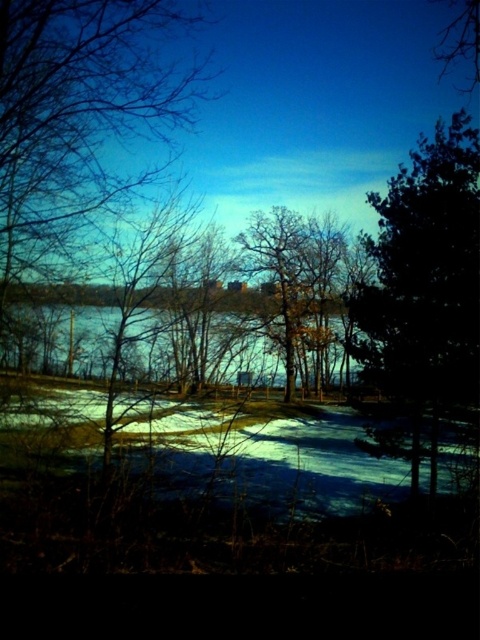
You are an outdoor photographer who wants to capture the reflection of the evening sky in the water. You see both frozen water at center and blue water at center. Which one should you choose to get a clear reflection?

You should choose the blue water at center because frozen water at center is to the right of blue water at center, and frozen water cannot reflect the sky as clearly as liquid blue water.

You are an explorer trying to cross a frozen lake. You notice two areas of water in the center of the image. The frozen water at center and the blue water at center are 1.57 meters apart. Can you safely walk between them without falling through the ice?

The frozen water at center and blue water at center are 1.57 meters apart. Since the distance between them is 1.57 meters, if the ice between them is thick enough to support your weight, you can walk between them. However, the presence of blue water might indicate thinner ice or open water, so caution is advised.

You are a hiker trying to determine the tallest object between the green leafy tree at right and the blue water at center in the winter landscape. Which one is taller?

The green leafy tree at right is taller than the blue water at center.